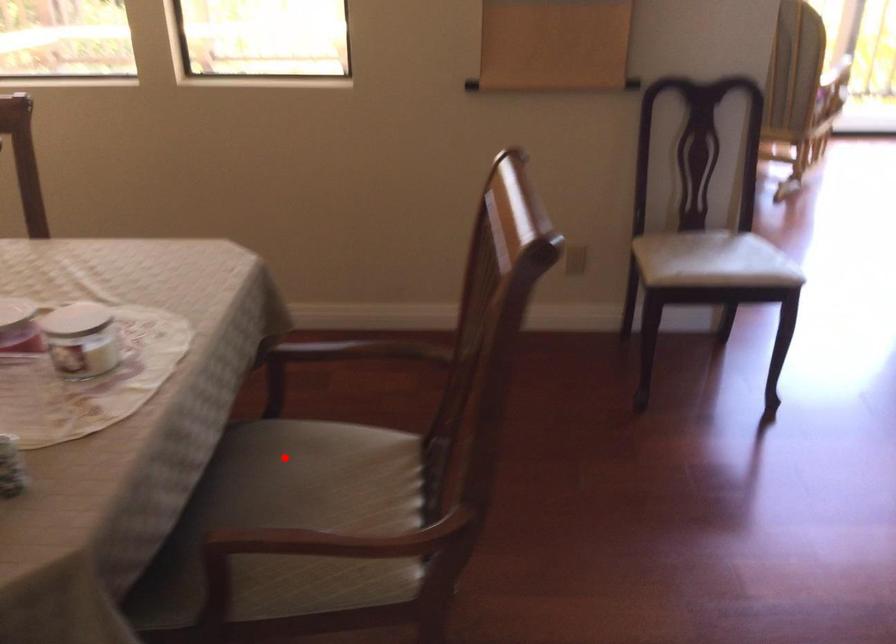
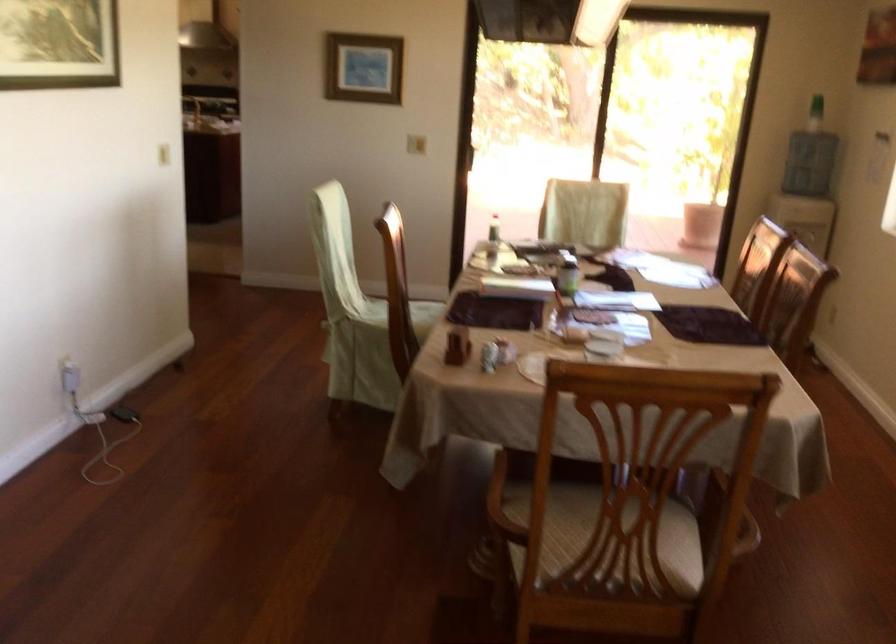
Find the pixel in the second image that matches the highlighted location in the first image.

(631, 513)